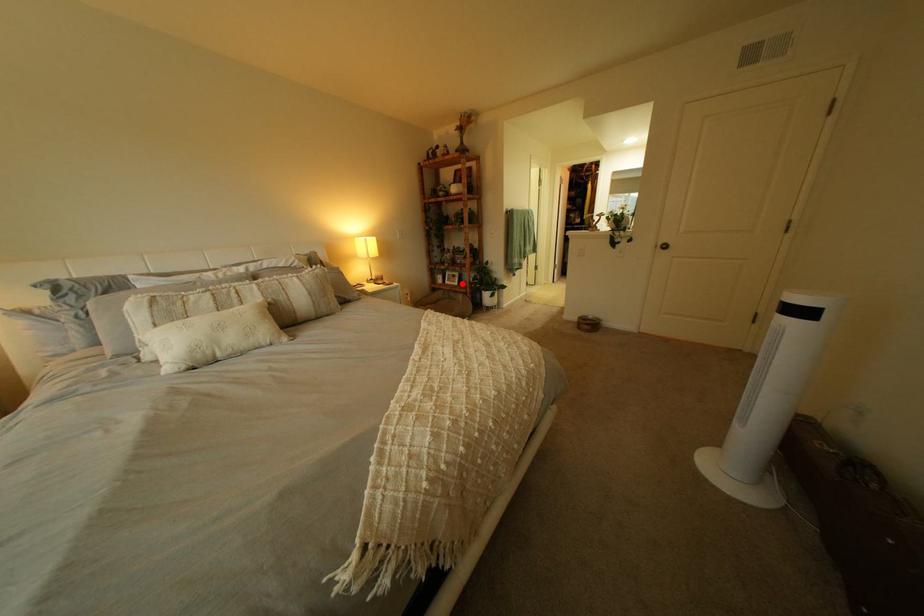
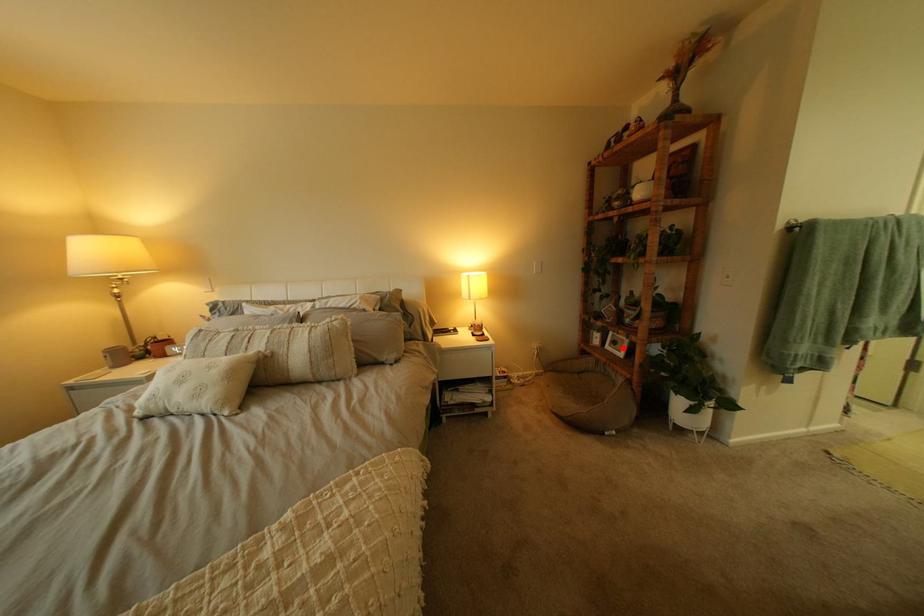
I am providing you with two images of the same scene from different viewpoints. A red point is marked on the first image and another point is marked on the second image. Is the red point in image1 aligned with the point shown in image2?

Yes